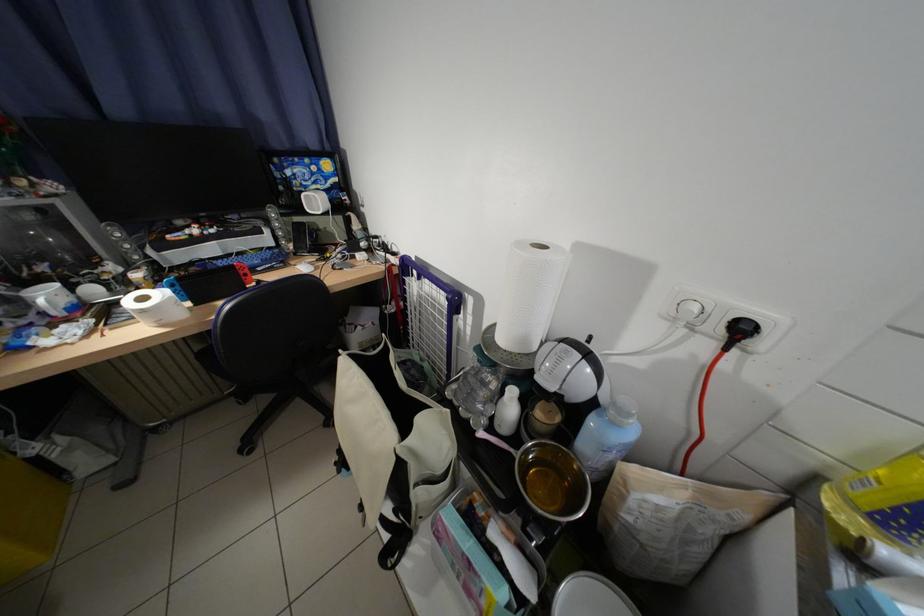
Locate an element on the screen. The height and width of the screenshot is (616, 924). white mug handle is located at coordinates (50, 299).